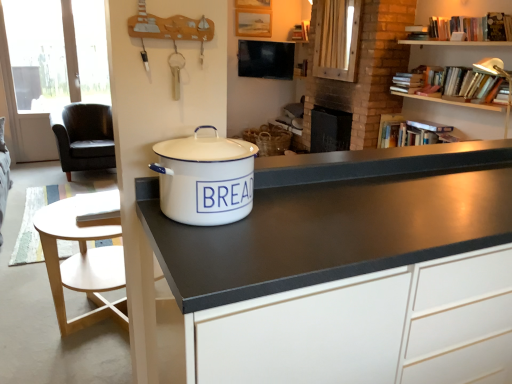
Question: Which is correct: hardcover books at upper right is inside light wood round table at lower left, or outside of it?

Choices:
 (A) outside
 (B) inside

Answer: (A)

Question: Is hardcover books at upper right to the left or to the right of light wood round table at lower left in the image?

Choices:
 (A) left
 (B) right

Answer: (B)

Question: Which object is positioned closest to the white enamel bread bin at center?

Choices:
 (A) black leather chair at left
 (B) light wood round table at lower left
 (C) hardcover books at upper right
 (D) white matte cabinet at center

Answer: (D)

Question: Which of these objects is positioned farthest from the black leather chair at left?

Choices:
 (A) white enamel bread bin at center
 (B) white matte cabinet at center
 (C) hardcover books at upper right
 (D) light wood round table at lower left

Answer: (B)